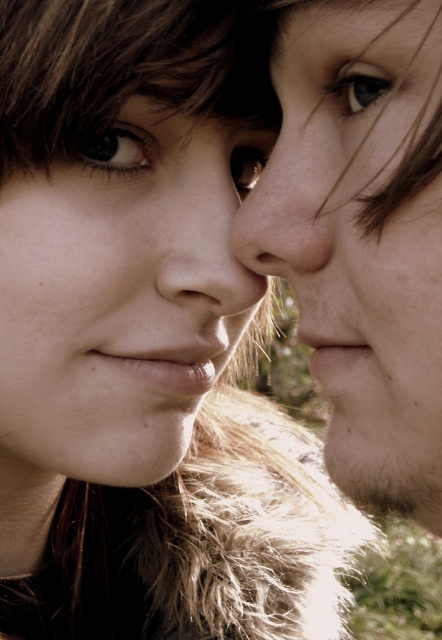
Who is positioned more to the right, matte skin nose at center or blue glossy eye at upper center?

blue glossy eye at upper center is more to the right.

Is point (197, 253) farther from camera compared to point (370, 65)?

Yes, point (197, 253) is farther from viewer.

Who is more forward, (x=208, y=196) or (x=351, y=108)?

Point (x=351, y=108) is in front.

Identify the location of matte skin nose at center. The height and width of the screenshot is (640, 442). (205, 228).

Between matte skin nose at center and brown matte eye at center, which one has more height?

With more height is matte skin nose at center.

Does matte skin nose at center appear under brown matte eye at center?

Correct, matte skin nose at center is located below brown matte eye at center.

Does point (240, 164) come farther from viewer compared to point (251, 170)?

No, (240, 164) is in front of (251, 170).

The width and height of the screenshot is (442, 640). I want to click on matte skin nose at center, so click(x=205, y=228).

Does point (86, 368) come closer to viewer compared to point (415, 198)?

No, (86, 368) is further to viewer.

Locate an element on the screen. The image size is (442, 640). smooth skin face at center is located at coordinates (118, 300).